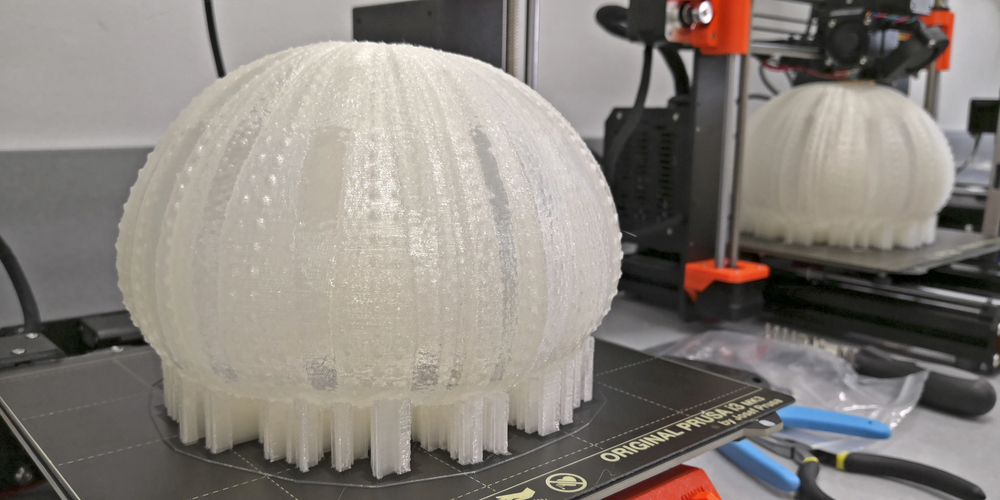
Locate an element on the screen. white part of wall at left is located at coordinates (91, 88).